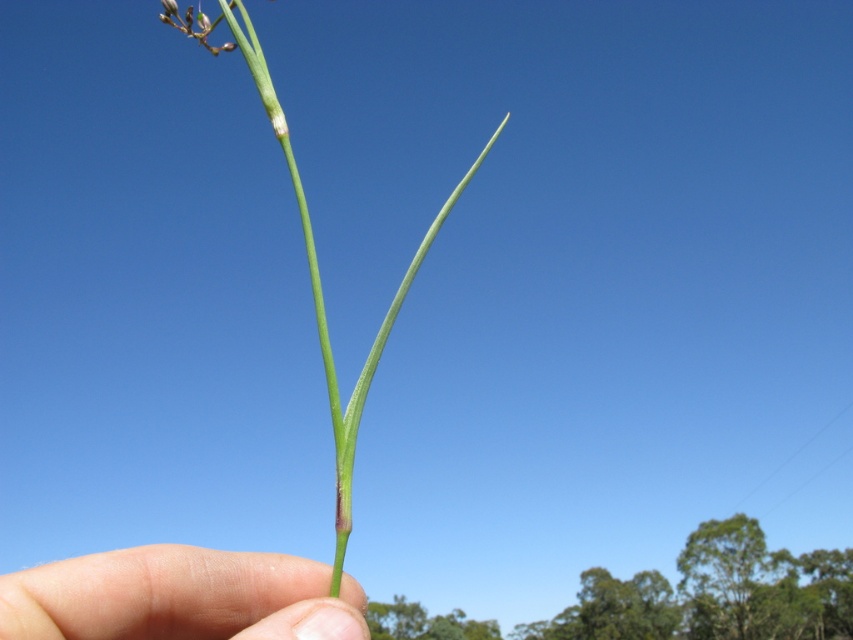
Does skin/soft/hand at lower center have a greater height compared to green matte stem at center?

No.

In the scene shown: Does skin/soft/hand at lower center have a greater width compared to green matte stem at center?

No, skin/soft/hand at lower center is not wider than green matte stem at center.

Is point (151, 609) behind point (338, 561)?

Yes, point (151, 609) is behind point (338, 561).

This screenshot has width=853, height=640. Find the location of `skin/soft/hand at lower center`. skin/soft/hand at lower center is located at coordinates (178, 596).